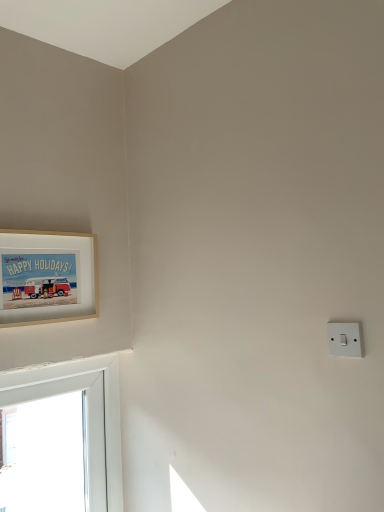
The width and height of the screenshot is (384, 512). Identify the location of wooden frame at upper left. (47, 277).

Measure the distance between point (46,318) and camera.

Point (46,318) and camera are 4.88 feet apart.

This screenshot has width=384, height=512. What do you see at coordinates (47, 277) in the screenshot?
I see `wooden frame at upper left` at bounding box center [47, 277].

Describe the element at coordinates (345, 339) in the screenshot. I see `white plastic light switch at right` at that location.

Locate an element on the screen. This screenshot has height=512, width=384. white plastic light switch at right is located at coordinates (345, 339).

Identify the location of wooden frame at upper left. (47, 277).

In the scene shown: In the image, is white plastic light switch at right on the left side or the right side of wooden frame at upper left?

white plastic light switch at right is to the right of wooden frame at upper left.

Does white plastic light switch at right lie in front of wooden frame at upper left?

That is True.

Is point (329, 322) less distant than point (94, 298)?

That is True.

From the image's perspective, is white plastic light switch at right positioned above or below wooden frame at upper left?

From the image's perspective, white plastic light switch at right appears below wooden frame at upper left.

From the picture: From a real-world perspective, is white plastic light switch at right under wooden frame at upper left?

Correct, in the physical world, white plastic light switch at right is lower than wooden frame at upper left.

Does white plastic light switch at right have a greater width compared to wooden frame at upper left?

Incorrect, the width of white plastic light switch at right does not surpass that of wooden frame at upper left.

In the scene shown: Between white plastic light switch at right and wooden frame at upper left, which one has more height?

wooden frame at upper left.

Between white plastic light switch at right and wooden frame at upper left, which one has larger size?

With larger size is wooden frame at upper left.

Based on the photo, can we say white plastic light switch at right lies outside wooden frame at upper left?

Yes.

Are white plastic light switch at right and wooden frame at upper left making contact?

There is a gap between white plastic light switch at right and wooden frame at upper left.

Could you tell me if white plastic light switch at right is turned towards wooden frame at upper left?

No, white plastic light switch at right does not turn towards wooden frame at upper left.

At what (x,y) coordinates should I click in order to perform the action: click on picture frame behind the white plastic light switch at right. Please return your answer as a coordinate pair (x, y). Image resolution: width=384 pixels, height=512 pixels. Looking at the image, I should click on (47, 277).

Can you confirm if wooden frame at upper left is positioned to the left of white plastic light switch at right?

Indeed, wooden frame at upper left is positioned on the left side of white plastic light switch at right.

Considering their positions, is wooden frame at upper left located in front of or behind white plastic light switch at right?

wooden frame at upper left is positioned farther from the viewer than white plastic light switch at right.

Is point (58, 252) positioned in front of point (337, 354)?

No, (58, 252) is further to viewer.

From the image's perspective, between wooden frame at upper left and white plastic light switch at right, who is located below?

white plastic light switch at right, from the image's perspective.

Looking at this image, from a real-world perspective, is wooden frame at upper left located beneath white plastic light switch at right?

No, from a real-world perspective, wooden frame at upper left is not below white plastic light switch at right.

Looking at their sizes, would you say wooden frame at upper left is wider or thinner than white plastic light switch at right?

wooden frame at upper left is wider than white plastic light switch at right.

Considering the sizes of objects wooden frame at upper left and white plastic light switch at right in the image provided, who is taller, wooden frame at upper left or white plastic light switch at right?

Standing taller between the two is wooden frame at upper left.

Is wooden frame at upper left bigger than white plastic light switch at right?

Yes.

Which is correct: wooden frame at upper left is inside white plastic light switch at right, or outside of it?

wooden frame at upper left is located beyond the bounds of white plastic light switch at right.

Is wooden frame at upper left beside white plastic light switch at right?

No, wooden frame at upper left is not touching white plastic light switch at right.

Could you tell me if wooden frame at upper left is facing white plastic light switch at right?

Yes, wooden frame at upper left is facing white plastic light switch at right.

How different are the orientations of wooden frame at upper left and white plastic light switch at right in degrees?

wooden frame at upper left and white plastic light switch at right are facing 89.6 degrees away from each other.

Measure the distance from wooden frame at upper left to white plastic light switch at right.

37.70 inches.

Locate an element on the screen. picture frame located above the white plastic light switch at right (from the image's perspective) is located at coordinates (47, 277).

Image resolution: width=384 pixels, height=512 pixels. I want to click on picture frame located above the white plastic light switch at right (from the image's perspective), so click(x=47, y=277).

Identify the location of light switch directly beneath the wooden frame at upper left (from a real-world perspective). This screenshot has height=512, width=384. (345, 339).